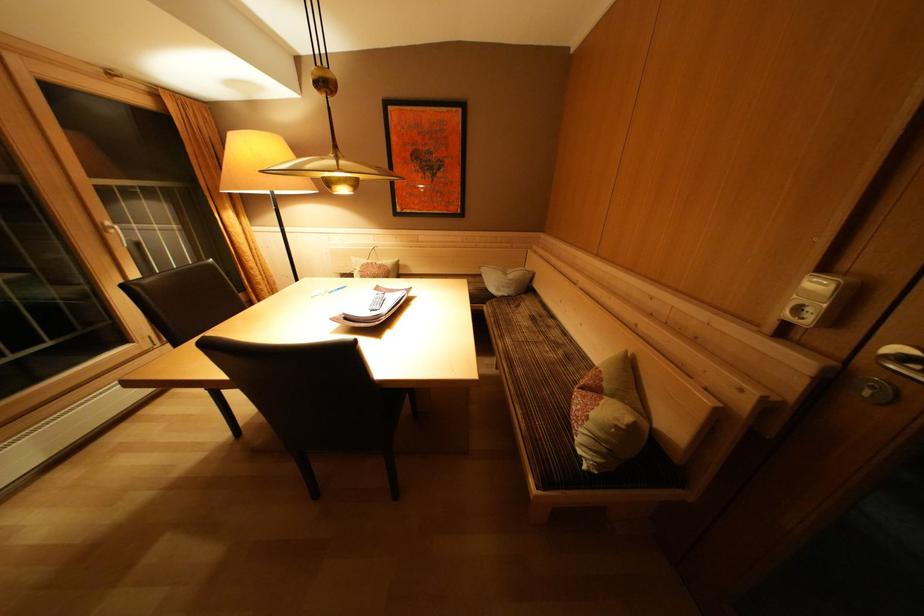
Locate an element on the screen. light switch is located at coordinates (819, 300).